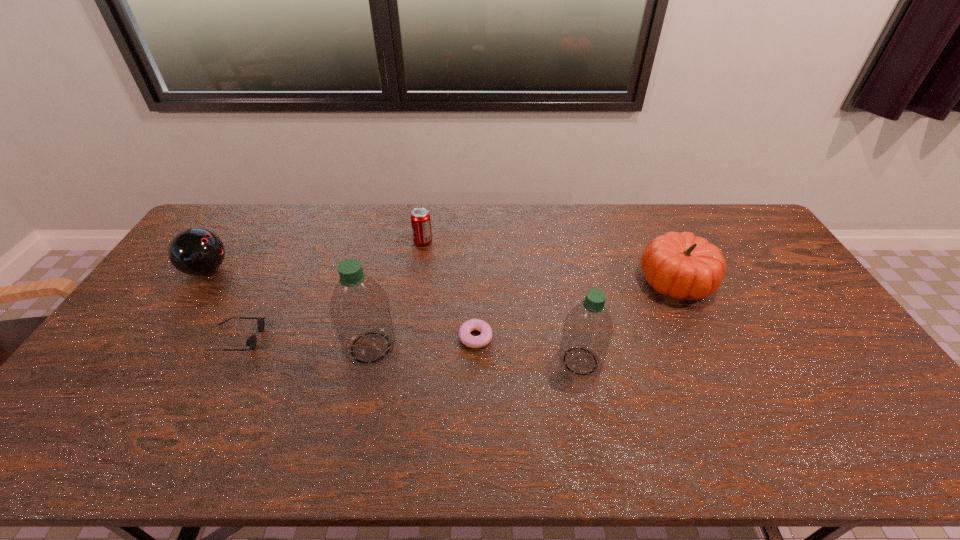
Locate an element on the screen. The height and width of the screenshot is (540, 960). vacant area that lies between the sixth object from left to right and the bowling ball is located at coordinates (394, 315).

Image resolution: width=960 pixels, height=540 pixels. Identify the location of free space between the leftmost object and the sixth object from left to right. (394, 315).

This screenshot has height=540, width=960. I want to click on free space between the second object from right to left and the rightmost object, so click(x=628, y=322).

This screenshot has width=960, height=540. In order to click on vacant point located between the sixth object from left to right and the leftmost object in this screenshot , I will do `click(394, 315)`.

Find the location of a particular element. The width and height of the screenshot is (960, 540). empty location between the second shortest object and the rightmost object is located at coordinates (457, 310).

Locate an element on the screen. Image resolution: width=960 pixels, height=540 pixels. free space between the farthest object and the fifth object from left to right is located at coordinates pyautogui.click(x=449, y=289).

Identify the location of vacant space that's between the pumpkin and the bowling ball. This screenshot has height=540, width=960. click(x=442, y=276).

At what (x,y) coordinates should I click in order to perform the action: click on free space between the left water bottle and the doughnut. Please return your answer as a coordinate pair (x, y). Image resolution: width=960 pixels, height=540 pixels. Looking at the image, I should click on (423, 342).

Find the location of a particular element. This screenshot has height=540, width=960. the fourth closest object to the third object from right to left is located at coordinates (681, 265).

This screenshot has height=540, width=960. Find the location of `object that can be found as the sixth closest to the tallest object`. object that can be found as the sixth closest to the tallest object is located at coordinates (681, 265).